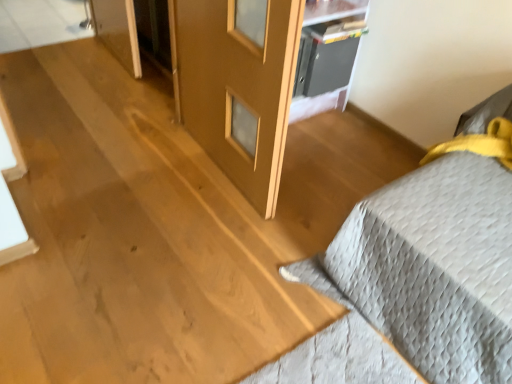
At what (x,y) coordinates should I click in order to perform the action: click on vacant space in matte wood screen door at center (from a real-world perspective). Please return your answer as a coordinate pair (x, y). The width and height of the screenshot is (512, 384). Looking at the image, I should click on (214, 168).